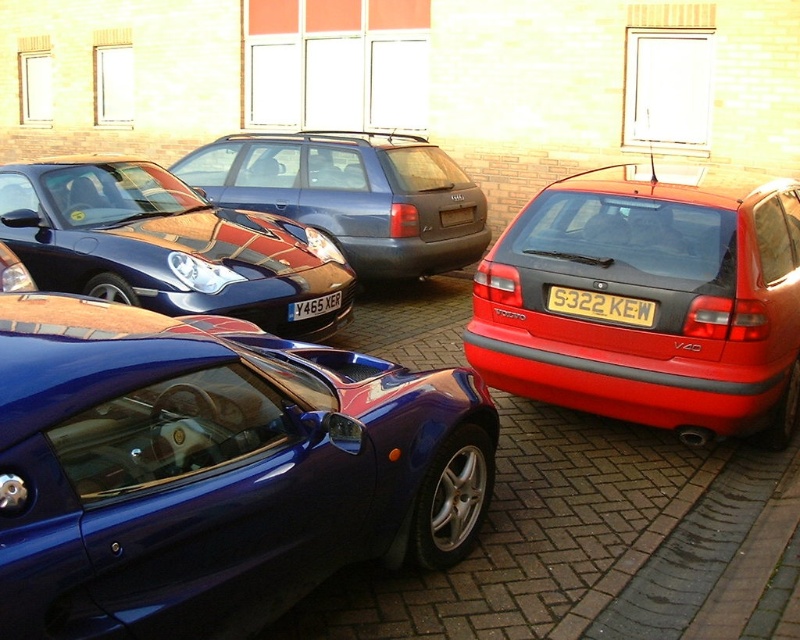
Question: Which object is positioned closest to the yellow matte license plate at center?

Choices:
 (A) yellow metallic license plate at center
 (B) glossy metallic car at center
 (C) glossy blue sports car at center

Answer: (A)

Question: Which point is closer to the camera?

Choices:
 (A) (649, 320)
 (B) (124, 420)

Answer: (B)

Question: Where is shiny metallic car at center located in relation to yellow matte license plate at center in the image?

Choices:
 (A) right
 (B) left

Answer: (B)

Question: Considering the real-world distances, which object is closest to the yellow metallic license plate at center?

Choices:
 (A) glossy blue sports car at center
 (B) shiny metallic car at center
 (C) glossy metallic car at center
 (D) yellow matte license plate at center

Answer: (A)

Question: Can you confirm if shiny metallic car at center is positioned to the left of yellow matte license plate at center?

Choices:
 (A) no
 (B) yes

Answer: (B)

Question: Is glossy red hatchback at right positioned in front of yellow metallic license plate at center?

Choices:
 (A) yes
 (B) no

Answer: (A)